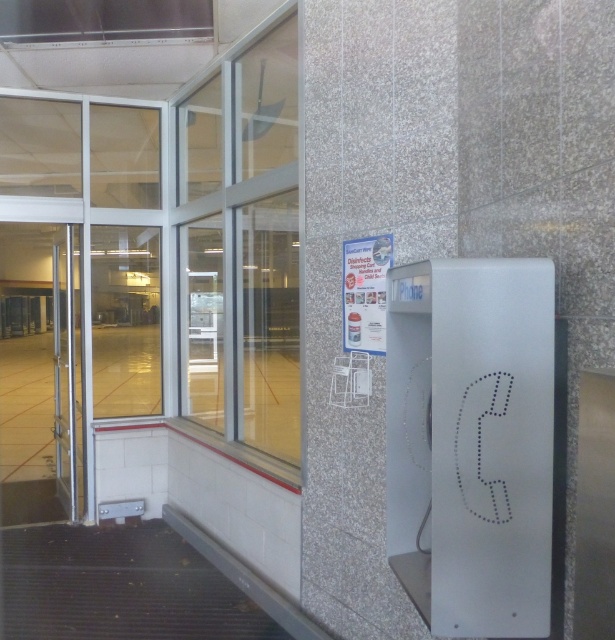
You are standing in front of the phone booth and want to make a call. Which object should you interact with first, the white plastic phone at right or the clear glass door at left?

You should interact with the clear glass door at left first because the white plastic phone at right is located below it, meaning the door must be opened to access the phone inside the booth.